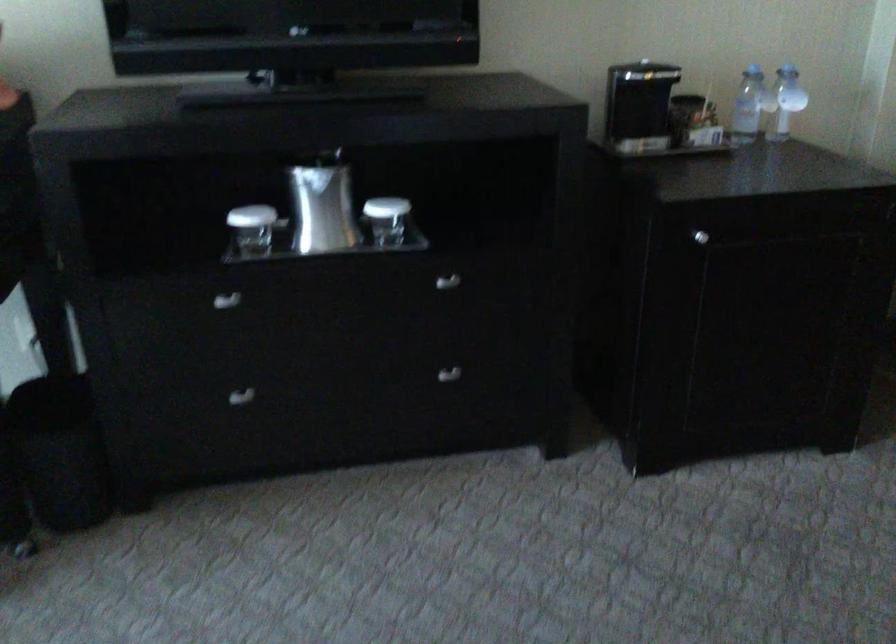
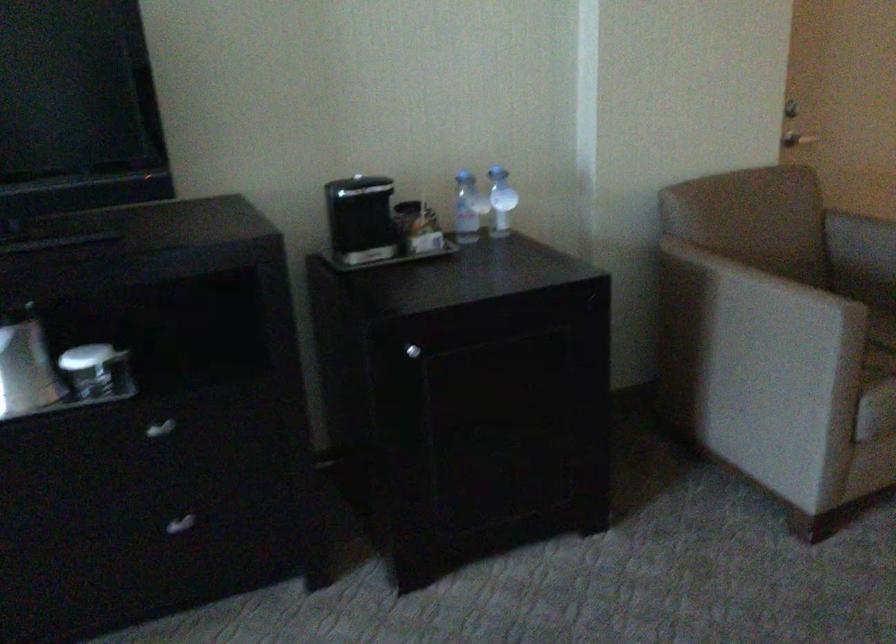
Question: The camera is either moving clockwise (left) or counter-clockwise (right) around the object. The first image is from the beginning of the video and the second image is from the end. Is the camera moving left or right when shooting the video?

Choices:
 (A) Left
 (B) Right

Answer: (A)